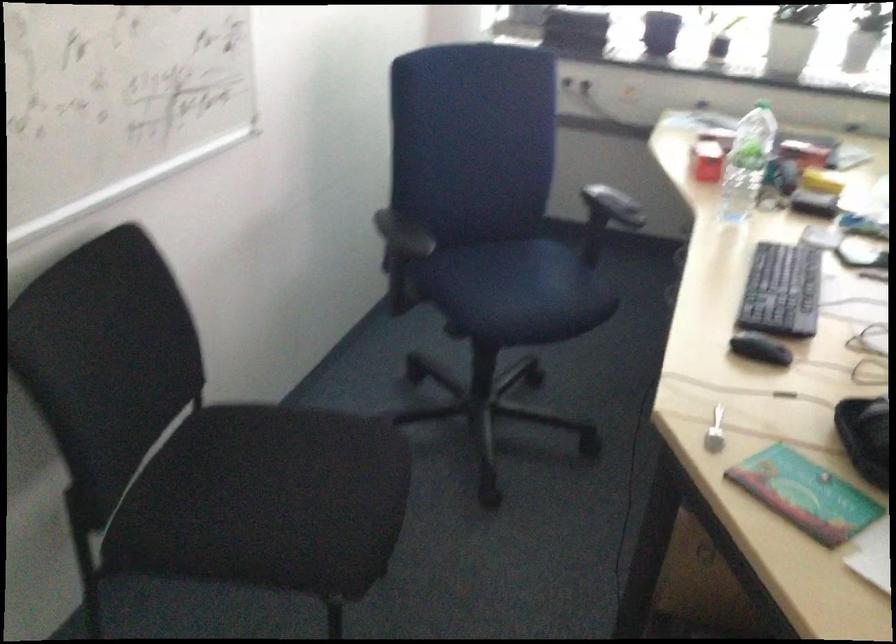
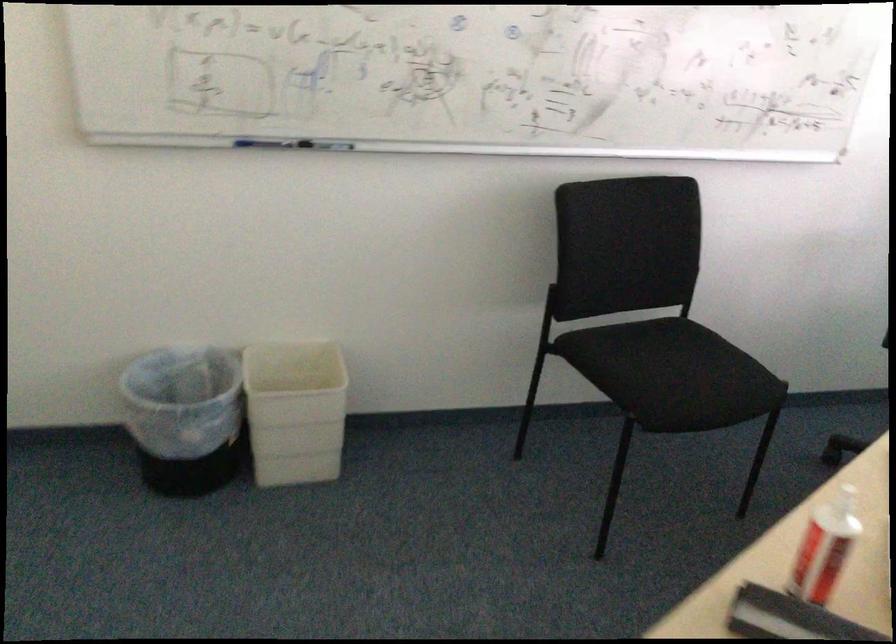
The point at (343, 495) is marked in the first image. Where is the corresponding point in the second image?

(688, 379)